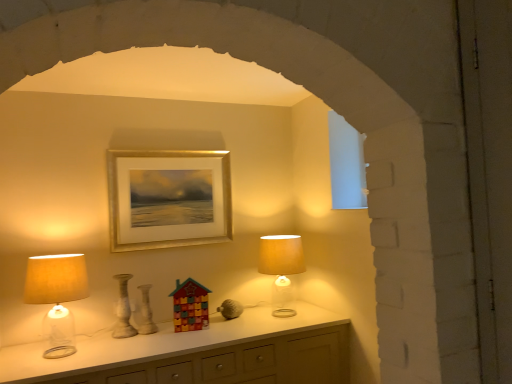
Question: Is white glossy vase at center, the second vase in the left-to-right sequence, taller than gold metallic picture frame at upper center?

Choices:
 (A) yes
 (B) no

Answer: (B)

Question: Can we say white glossy vase at center, the second vase in the left-to-right sequence, lies outside gold metallic picture frame at upper center?

Choices:
 (A) yes
 (B) no

Answer: (A)

Question: Can you confirm if white glossy vase at center, the second vase in the left-to-right sequence, is positioned to the left of gold metallic picture frame at upper center?

Choices:
 (A) no
 (B) yes

Answer: (B)

Question: Is white glossy vase at center, which is the first vase from right to left, smaller than gold metallic picture frame at upper center?

Choices:
 (A) yes
 (B) no

Answer: (A)

Question: From a real-world perspective, is white glossy vase at center, the second vase in the left-to-right sequence, below gold metallic picture frame at upper center?

Choices:
 (A) no
 (B) yes

Answer: (B)

Question: Is white glossy vase at center, the second vase in the left-to-right sequence, to the left or to the right of matte beige lampshade at left, the first lamp in the left-to-right sequence, in the image?

Choices:
 (A) left
 (B) right

Answer: (B)

Question: Would you say white glossy vase at center, which is the first vase from right to left, is inside or outside matte beige lampshade at left, which is the second lamp in right-to-left order?

Choices:
 (A) inside
 (B) outside

Answer: (B)

Question: From their relative heights in the image, would you say white glossy vase at center, which is the first vase from right to left, is taller or shorter than matte beige lampshade at left, the first lamp in the left-to-right sequence?

Choices:
 (A) short
 (B) tall

Answer: (A)

Question: Is point (139, 312) positioned closer to the camera than point (47, 301)?

Choices:
 (A) closer
 (B) farther

Answer: (B)

Question: Considering the positions of point (146, 215) and point (128, 329), is point (146, 215) closer or farther from the camera than point (128, 329)?

Choices:
 (A) closer
 (B) farther

Answer: (B)

Question: Looking at the image, does gold metallic picture frame at upper center seem bigger or smaller compared to speckled ceramic vase at center, which is the 1th vase from left to right?

Choices:
 (A) big
 (B) small

Answer: (A)

Question: From the image's perspective, is gold metallic picture frame at upper center located above or below speckled ceramic vase at center, which is the 1th vase from left to right?

Choices:
 (A) below
 (B) above

Answer: (B)

Question: Visually, is gold metallic picture frame at upper center positioned to the left or to the right of speckled ceramic vase at center, which is the 1th vase from left to right?

Choices:
 (A) right
 (B) left

Answer: (A)

Question: Is point (283, 246) closer or farther from the camera than point (140, 314)?

Choices:
 (A) closer
 (B) farther

Answer: (A)

Question: In terms of width, does matte beige lampshade at right, which is the second lamp from left to right, look wider or thinner when compared to white glossy vase at center, the second vase in the left-to-right sequence?

Choices:
 (A) thin
 (B) wide

Answer: (B)